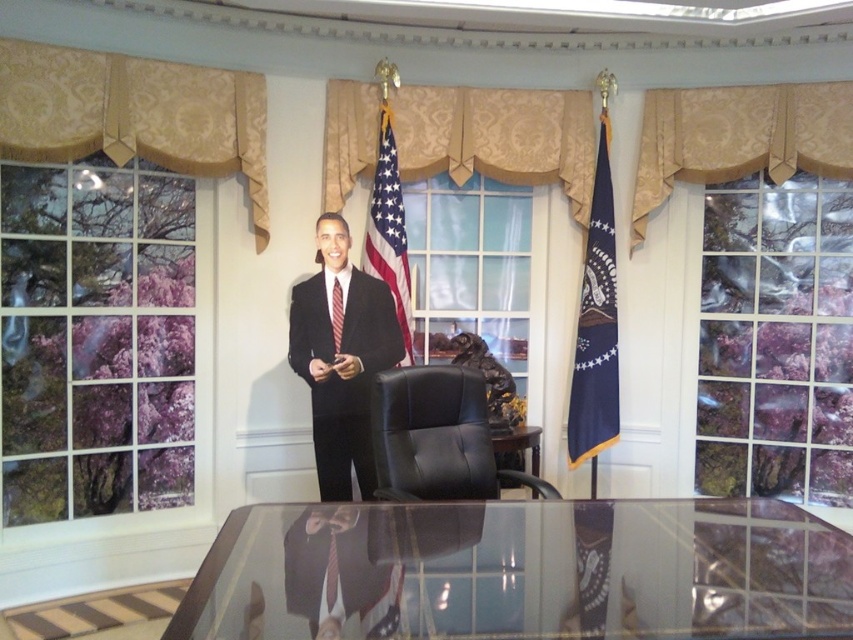
Question: Can you confirm if navy blue fabric flag at right is wider than red silk tie at center?

Choices:
 (A) yes
 (B) no

Answer: (A)

Question: Which of the following is the farthest from the observer?

Choices:
 (A) black leather chair at center
 (B) gold damask valance at upper center
 (C) red silk tie at center

Answer: (B)

Question: Is gold damask valance at upper left to the right of american flag at center from the viewer's perspective?

Choices:
 (A) no
 (B) yes

Answer: (A)

Question: Can you confirm if gold damask curtain at center is smaller than navy blue fabric flag at right?

Choices:
 (A) no
 (B) yes

Answer: (A)

Question: Considering the real-world distances, which object is farthest from the transparent glass table at center?

Choices:
 (A) gold damask valance at upper left
 (B) black leather chair at center
 (C) gold damask curtain at center

Answer: (C)

Question: Which of the following is the farthest from the observer?

Choices:
 (A) (672, 580)
 (B) (403, 308)
 (C) (90, 81)
 (D) (311, 381)

Answer: (B)